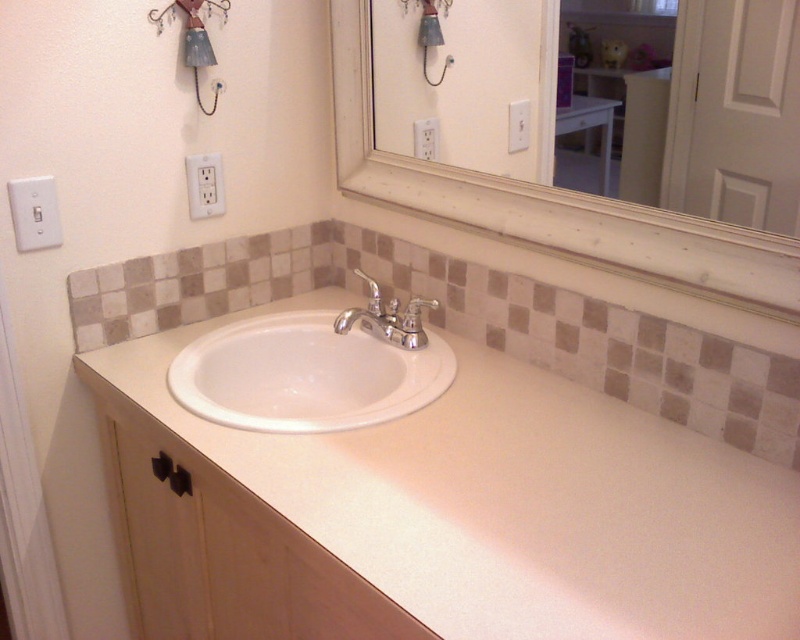
Question: Among these objects, which one is farthest from the camera?

Choices:
 (A) white plastic outlet at upper left
 (B) white laminate sink at center
 (C) white plastic outlet at upper center

Answer: (A)

Question: Among these points, which one is nearest to the camera?

Choices:
 (A) (510, 602)
 (B) (416, 348)
 (C) (428, 145)

Answer: (A)

Question: Observing the image, what is the correct spatial positioning of white plastic/light switch at upper left in reference to white plastic outlet at upper center?

Choices:
 (A) right
 (B) left

Answer: (B)

Question: Estimate the real-world distances between objects in this image. Which object is closer to the white laminate sink at center?

Choices:
 (A) white ceramic sink at center
 (B) white glossy vanity at upper center
 (C) chrome/metallic faucet at center

Answer: (A)

Question: Can you confirm if white laminate sink at center is positioned to the right of white ceramic sink at center?

Choices:
 (A) no
 (B) yes

Answer: (B)

Question: Can you confirm if white ceramic sink at center is positioned below white plastic outlet at upper left?

Choices:
 (A) no
 (B) yes

Answer: (B)